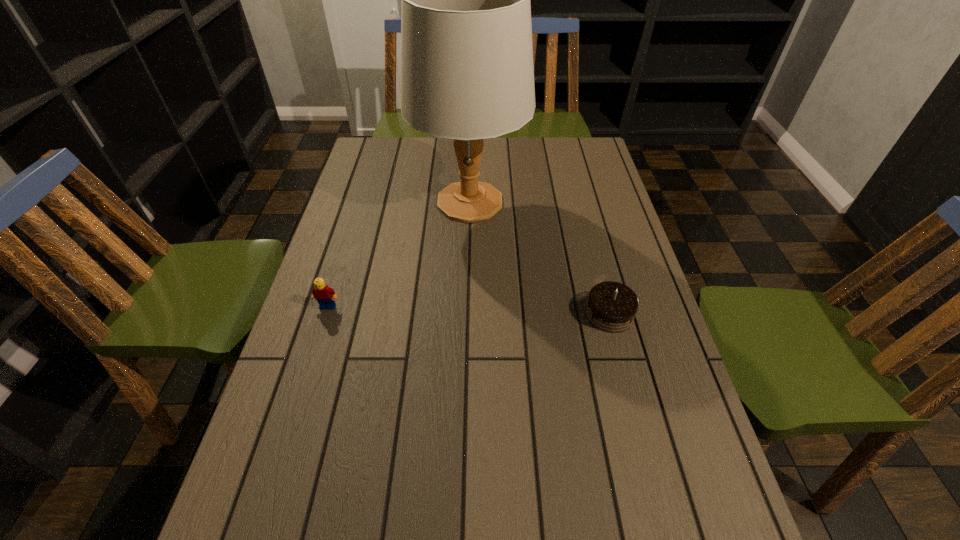
This screenshot has height=540, width=960. Identify the location of vacant space at the far edge of the desktop. (482, 159).

In the image, there is a desktop. Identify the location of vacant space at the left edge. This screenshot has width=960, height=540. (382, 226).

At what (x,y) coordinates should I click in order to perform the action: click on vacant space at the right edge of the desktop. Please return your answer as a coordinate pair (x, y). Looking at the image, I should click on (715, 524).

This screenshot has height=540, width=960. Find the location of `free space at the far right corner of the desktop`. free space at the far right corner of the desktop is located at coordinates (587, 147).

Locate an element on the screen. The width and height of the screenshot is (960, 540). vacant area between the chocolate cake and the Lego is located at coordinates click(x=468, y=310).

Image resolution: width=960 pixels, height=540 pixels. In order to click on free space that is in between the chocolate cake and the Lego in this screenshot , I will do `click(468, 310)`.

Where is `empty space that is in between the rightmost object and the Lego`? This screenshot has width=960, height=540. empty space that is in between the rightmost object and the Lego is located at coordinates (468, 310).

Where is `free space between the tallest object and the leftmost object`? The height and width of the screenshot is (540, 960). free space between the tallest object and the leftmost object is located at coordinates (398, 254).

Find the location of a particular element. The height and width of the screenshot is (540, 960). free space that is in between the leftmost object and the chocolate cake is located at coordinates (468, 310).

Where is `free spot between the Lego and the second object from right to left`? The width and height of the screenshot is (960, 540). free spot between the Lego and the second object from right to left is located at coordinates (398, 254).